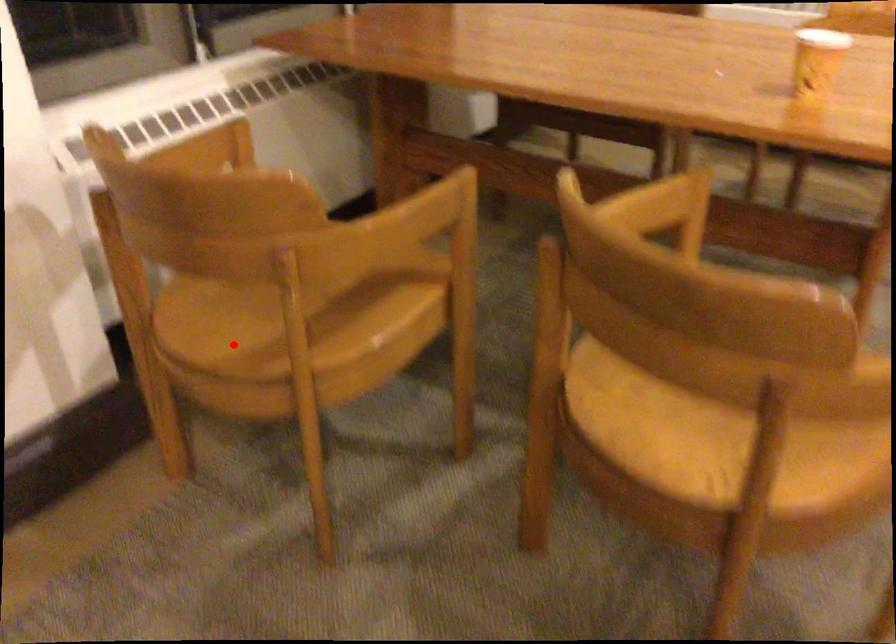
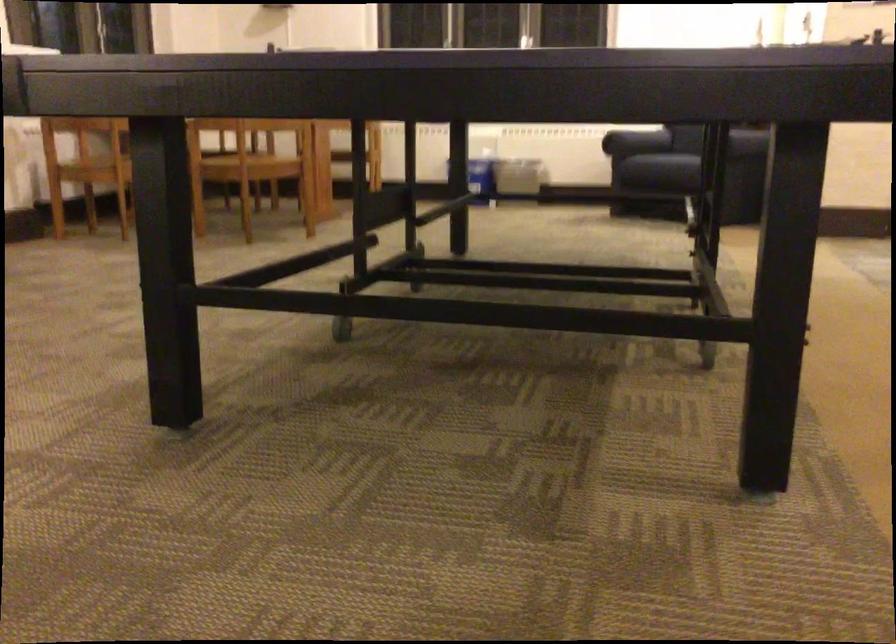
Question: I am providing you with two images of the same scene from different viewpoints. Given a red point in image1, look at the same physical point in image2. Is it:

Choices:
 (A) Closer to the viewpoint
 (B) Farther from the viewpoint

Answer: (B)